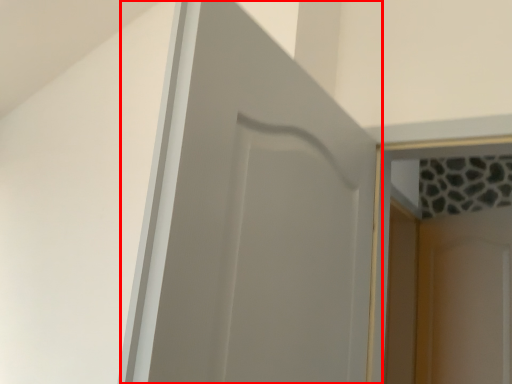
Question: In this image, where is door (annotated by the red box) located relative to screen door?

Choices:
 (A) left
 (B) right

Answer: (A)